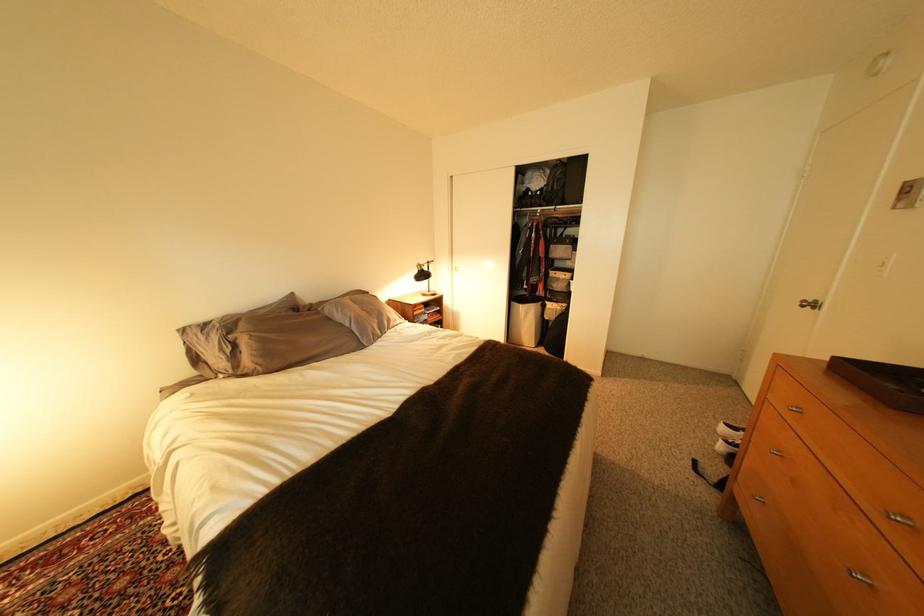
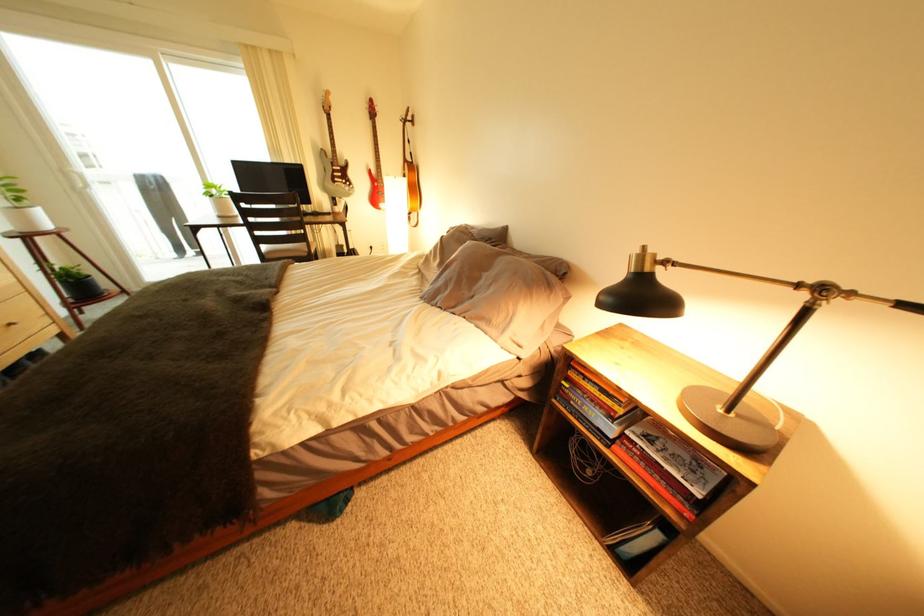
In the second image, find the point that corresponds to pixel 407 322 in the first image.

(503, 323)